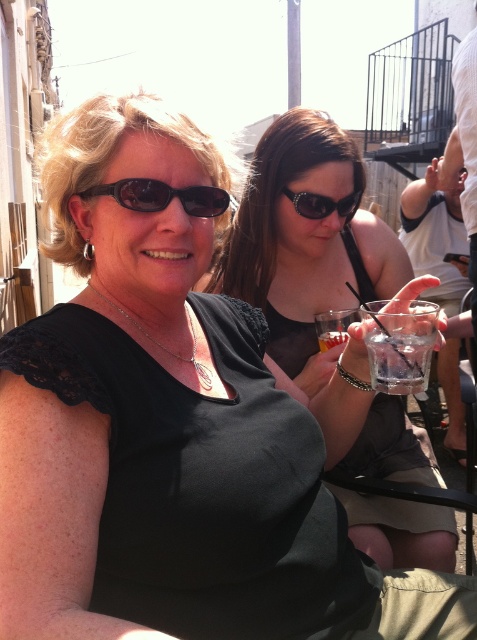
Question: Which object is positioned closest to the black shiny sunglasses at center?

Choices:
 (A) clear glass at lower right
 (B) matte black sunglasses at upper left
 (C) clear glass at center
 (D) black matte shirt at center

Answer: (D)

Question: Is clear glass at lower right in front of matte black sunglasses at upper left?

Choices:
 (A) yes
 (B) no

Answer: (B)

Question: Which of the following is the closest to the observer?

Choices:
 (A) clear glass at center
 (B) black shiny sunglasses at center
 (C) clear glass at lower right
 (D) black matte shirt at center

Answer: (C)

Question: Is the position of matte black sunglasses at upper left less distant than that of black shiny sunglasses at center?

Choices:
 (A) yes
 (B) no

Answer: (A)

Question: Which point is closer to the camera?

Choices:
 (A) clear glass at lower right
 (B) black shiny sunglasses at center
 (C) black matte shirt at center
 (D) matte black sunglasses at upper left

Answer: (D)

Question: Is black matte shirt at center to the right of black shiny sunglasses at center from the viewer's perspective?

Choices:
 (A) no
 (B) yes

Answer: (B)